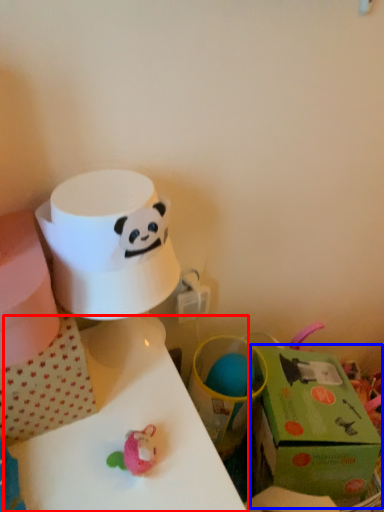
Question: Among these objects, which one is nearest to the camera, table (highlighted by a red box) or gift box (highlighted by a blue box)?

Choices:
 (A) table
 (B) gift box

Answer: (A)